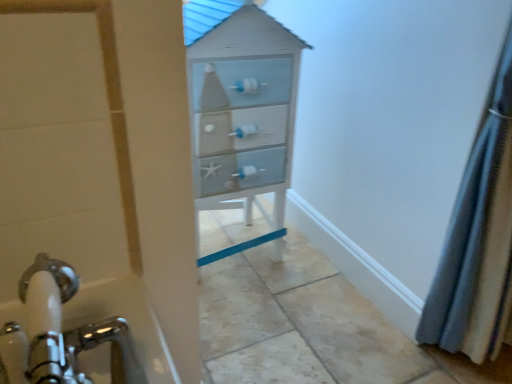
What do you see at coordinates (478, 238) in the screenshot? The image size is (512, 384). I see `gray fabric shower curtain at right` at bounding box center [478, 238].

The image size is (512, 384). What are the coordinates of `gray fabric shower curtain at right` in the screenshot? It's located at tap(478, 238).

In order to face gray fabric shower curtain at right, should I rotate leftwards or rightwards?

Turn right approximately 32.032 degrees to face it.

Where is `light blue painted wood chest of drawers at center`? light blue painted wood chest of drawers at center is located at coordinates (243, 117).

What do you see at coordinates (243, 117) in the screenshot? I see `light blue painted wood chest of drawers at center` at bounding box center [243, 117].

This screenshot has height=384, width=512. Identify the location of gray fabric shower curtain at right. (478, 238).

Between light blue painted wood chest of drawers at center and gray fabric shower curtain at right, which one appears on the right side from the viewer's perspective?

gray fabric shower curtain at right is more to the right.

Is light blue painted wood chest of drawers at center in front of or behind gray fabric shower curtain at right in the image?

In the image, light blue painted wood chest of drawers at center appears behind gray fabric shower curtain at right.

Is point (212, 43) closer to camera compared to point (511, 261)?

No, it is behind (511, 261).

From the image's perspective, would you say light blue painted wood chest of drawers at center is shown under gray fabric shower curtain at right?

No, from the image's perspective, light blue painted wood chest of drawers at center is not below gray fabric shower curtain at right.

From a real-world perspective, is light blue painted wood chest of drawers at center physically above gray fabric shower curtain at right?

No, from a real-world perspective, light blue painted wood chest of drawers at center is not on top of gray fabric shower curtain at right.

Considering the sizes of objects light blue painted wood chest of drawers at center and gray fabric shower curtain at right in the image provided, who is wider, light blue painted wood chest of drawers at center or gray fabric shower curtain at right?

With larger width is light blue painted wood chest of drawers at center.

Which of these two, light blue painted wood chest of drawers at center or gray fabric shower curtain at right, stands shorter?

light blue painted wood chest of drawers at center.

Which of these two, light blue painted wood chest of drawers at center or gray fabric shower curtain at right, is bigger?

With larger size is light blue painted wood chest of drawers at center.

Is light blue painted wood chest of drawers at center outside of gray fabric shower curtain at right?

light blue painted wood chest of drawers at center is positioned outside gray fabric shower curtain at right.

Does light blue painted wood chest of drawers at center touch gray fabric shower curtain at right?

light blue painted wood chest of drawers at center and gray fabric shower curtain at right are not in contact.

Is light blue painted wood chest of drawers at center aimed at gray fabric shower curtain at right?

No, light blue painted wood chest of drawers at center is not facing towards gray fabric shower curtain at right.

Can you tell me how much light blue painted wood chest of drawers at center and gray fabric shower curtain at right differ in facing direction?

light blue painted wood chest of drawers at center and gray fabric shower curtain at right are facing 2.24 degrees away from each other.

Where is `chest of drawers on the left of gray fabric shower curtain at right`? chest of drawers on the left of gray fabric shower curtain at right is located at coordinates (243, 117).

Based on their positions, is gray fabric shower curtain at right located to the left or right of light blue painted wood chest of drawers at center?

In the image, gray fabric shower curtain at right appears on the right side of light blue painted wood chest of drawers at center.

Considering the relative positions of gray fabric shower curtain at right and light blue painted wood chest of drawers at center in the image provided, is gray fabric shower curtain at right behind light blue painted wood chest of drawers at center?

No, the depth of gray fabric shower curtain at right is less than that of light blue painted wood chest of drawers at center.

Considering the positions of point (441, 321) and point (234, 132), is point (441, 321) closer or farther from the camera than point (234, 132)?

Clearly, point (441, 321) is closer to the camera than point (234, 132).

From the image's perspective, is gray fabric shower curtain at right on light blue painted wood chest of drawers at center?

No, from the image's perspective, gray fabric shower curtain at right is not on top of light blue painted wood chest of drawers at center.

From a real-world perspective, is gray fabric shower curtain at right positioned above or below light blue painted wood chest of drawers at center?

gray fabric shower curtain at right is situated higher than light blue painted wood chest of drawers at center in the real world.

Considering the sizes of objects gray fabric shower curtain at right and light blue painted wood chest of drawers at center in the image provided, who is wider, gray fabric shower curtain at right or light blue painted wood chest of drawers at center?

Wider between the two is light blue painted wood chest of drawers at center.

Considering the sizes of gray fabric shower curtain at right and light blue painted wood chest of drawers at center in the image, is gray fabric shower curtain at right taller or shorter than light blue painted wood chest of drawers at center?

Clearly, gray fabric shower curtain at right is taller compared to light blue painted wood chest of drawers at center.

Does gray fabric shower curtain at right have a larger size compared to light blue painted wood chest of drawers at center?

Actually, gray fabric shower curtain at right might be smaller than light blue painted wood chest of drawers at center.

Is light blue painted wood chest of drawers at center inside gray fabric shower curtain at right?

No.

Is the surface of gray fabric shower curtain at right in direct contact with light blue painted wood chest of drawers at center?

No, gray fabric shower curtain at right is not with light blue painted wood chest of drawers at center.

Is gray fabric shower curtain at right aimed at light blue painted wood chest of drawers at center?

No, gray fabric shower curtain at right is not oriented towards light blue painted wood chest of drawers at center.

How distant is gray fabric shower curtain at right from light blue painted wood chest of drawers at center?

gray fabric shower curtain at right and light blue painted wood chest of drawers at center are 26.42 inches apart from each other.

Where is `shower curtain on the right of light blue painted wood chest of drawers at center`? This screenshot has height=384, width=512. shower curtain on the right of light blue painted wood chest of drawers at center is located at coordinates [478, 238].

Identify the location of shower curtain lying on the right of light blue painted wood chest of drawers at center. (478, 238).

In order to click on chest of drawers on the left of gray fabric shower curtain at right in this screenshot , I will do pos(243,117).